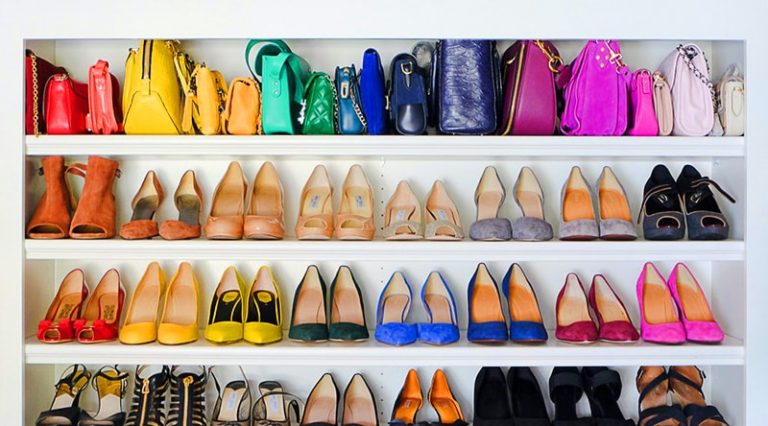
Find the location of `shelves`. shelves is located at coordinates (325, 411), (359, 344), (389, 247), (381, 141).